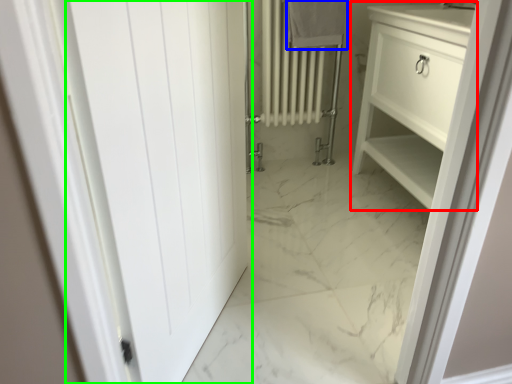
Question: Based on their relative distances, which object is nearer to bathroom cabinet (highlighted by a red box)? Choose from bath towel (highlighted by a blue box) and door (highlighted by a green box).

Choices:
 (A) bath towel
 (B) door

Answer: (A)